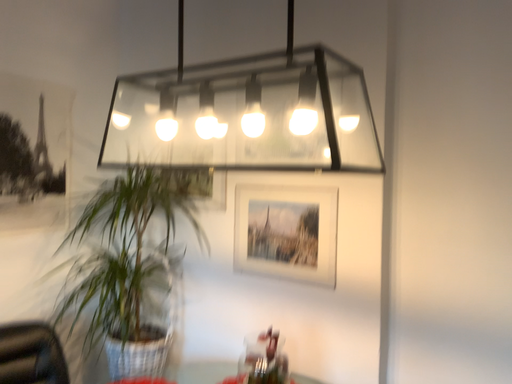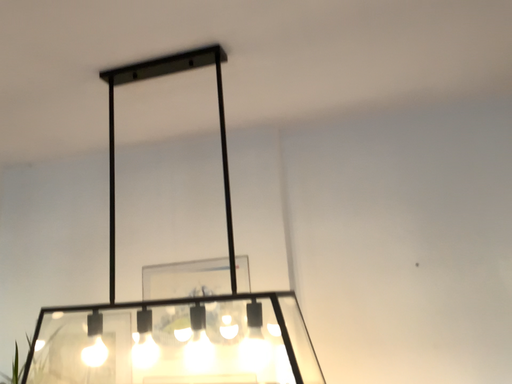
Question: Which way did the camera rotate in the video?

Choices:
 (A) rotated upward
 (B) rotated downward

Answer: (A)